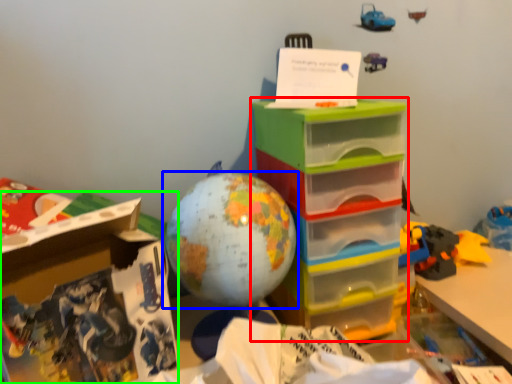
Question: Which object is positioned farthest from storage box (highlighted by a red box)? Select from toy (highlighted by a blue box) and cardboard box (highlighted by a green box).

Choices:
 (A) toy
 (B) cardboard box

Answer: (B)